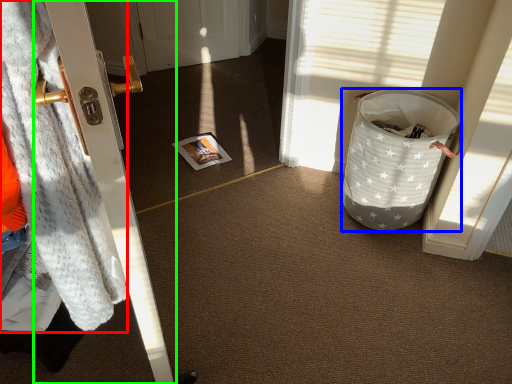
Question: Considering the real-world distances, which object is farthest from blanket (highlighted by a red box)? trash bin/can (highlighted by a blue box) or door (highlighted by a green box)?

Choices:
 (A) trash bin/can
 (B) door

Answer: (A)